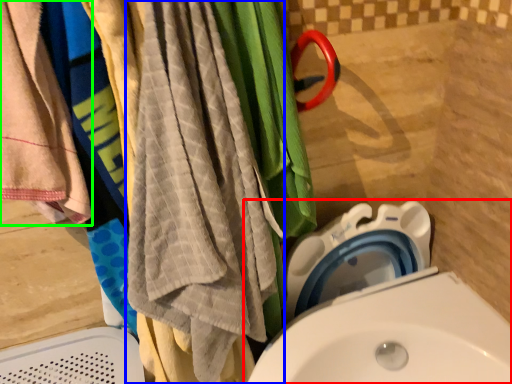
Question: Which is nearer to the toilet (highlighted by a red box)? beach towel (highlighted by a blue box) or towel (highlighted by a green box).

Choices:
 (A) beach towel
 (B) towel

Answer: (A)